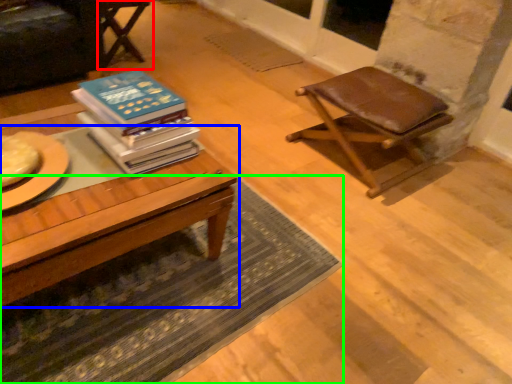
Question: Estimate the real-world distances between objects in this image. Which object is closer to chair (highlighted by a red box), table (highlighted by a blue box) or mat (highlighted by a green box)?

Choices:
 (A) table
 (B) mat

Answer: (A)